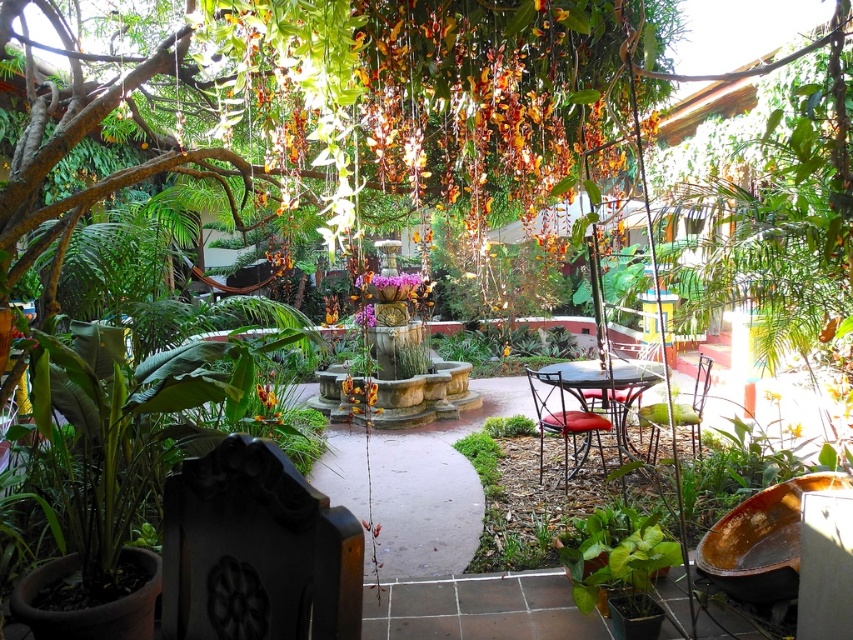
Which is in front, point (606, 372) or point (651, 442)?

Point (606, 372) is in front.

Between metallic red chair at center and metallic green chair at center-right, which one appears on the right side from the viewer's perspective?

Positioned to the right is metallic green chair at center-right.

This screenshot has height=640, width=853. I want to click on metallic red chair at center, so click(621, 394).

In order to click on metallic red chair at center in this screenshot , I will do pos(621,394).

Which is behind, point (602, 419) or point (698, 429)?

Positioned behind is point (698, 429).

Is metallic red cushioned chair at center in front of metallic green chair at center-right?

Yes, metallic red cushioned chair at center is closer to the viewer.

Image resolution: width=853 pixels, height=640 pixels. Describe the element at coordinates (564, 422) in the screenshot. I see `metallic red cushioned chair at center` at that location.

Find the location of `metallic red cushioned chair at center`. metallic red cushioned chair at center is located at coordinates (564, 422).

Can you confirm if green leafy plant at center is taller than metallic brown table at center?

Indeed, green leafy plant at center has a greater height compared to metallic brown table at center.

Who is lower down, green leafy plant at center or metallic brown table at center?

metallic brown table at center

Who is more distant from viewer, (434, 332) or (640, 365)?

Point (434, 332)

Locate an element on the screen. This screenshot has height=640, width=853. green leafy plant at center is located at coordinates (509, 344).